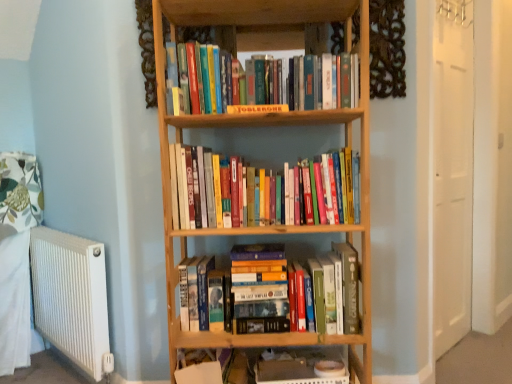
Question: Is the surface of hardcover books at center, the second book from the bottom, in direct contact with wooden shelf at lower center?

Choices:
 (A) no
 (B) yes

Answer: (A)

Question: Considering the relative positions of hardcover books at center, the second book from the bottom, and wooden shelf at lower center in the image provided, is hardcover books at center, the second book from the bottom, in front of wooden shelf at lower center?

Choices:
 (A) yes
 (B) no

Answer: (A)

Question: Does hardcover books at center, the second book in the top-to-bottom sequence, have a greater height compared to wooden shelf at lower center?

Choices:
 (A) no
 (B) yes

Answer: (B)

Question: Does hardcover books at center, the second book from the bottom, have a greater width compared to wooden shelf at lower center?

Choices:
 (A) yes
 (B) no

Answer: (B)

Question: Is wooden shelf at lower center located within hardcover books at center, the second book from the bottom?

Choices:
 (A) no
 (B) yes

Answer: (A)

Question: From the image's perspective, is hardcover books at upper center, the 1th book when ordered from top to bottom, above or below hardcover books at center, the second book in the top-to-bottom sequence?

Choices:
 (A) below
 (B) above

Answer: (B)

Question: From a real-world perspective, is hardcover books at upper center, placed as the 3th book when sorted from bottom to top, positioned above or below hardcover books at center, the second book from the bottom?

Choices:
 (A) above
 (B) below

Answer: (A)

Question: Would you say hardcover books at upper center, the 1th book when ordered from top to bottom, is inside or outside hardcover books at center, the second book from the bottom?

Choices:
 (A) inside
 (B) outside

Answer: (B)

Question: Based on their positions, is hardcover books at upper center, the 1th book when ordered from top to bottom, located to the left or right of hardcover books at center, the second book in the top-to-bottom sequence?

Choices:
 (A) left
 (B) right

Answer: (A)

Question: From the image's perspective, relative to wooden shelf at lower center, is matte yellow book at center above or below?

Choices:
 (A) below
 (B) above

Answer: (B)

Question: Is matte yellow book at center wider or thinner than wooden shelf at lower center?

Choices:
 (A) thin
 (B) wide

Answer: (A)

Question: Is matte yellow book at center bigger or smaller than wooden shelf at lower center?

Choices:
 (A) small
 (B) big

Answer: (A)

Question: In terms of height, does matte yellow book at center look taller or shorter compared to wooden shelf at lower center?

Choices:
 (A) short
 (B) tall

Answer: (A)

Question: In the image, is wooden shelf at lower center positioned in front of or behind hardcover books at center, placed as the first book when sorted from bottom to top?

Choices:
 (A) front
 (B) behind

Answer: (B)

Question: Visually, is wooden shelf at lower center positioned to the left or to the right of hardcover books at center, placed as the first book when sorted from bottom to top?

Choices:
 (A) right
 (B) left

Answer: (A)